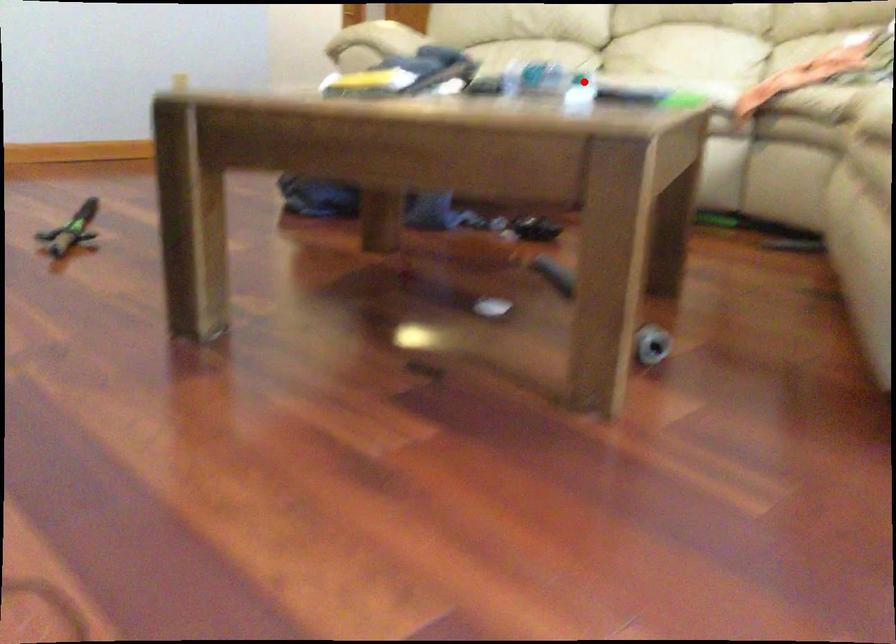
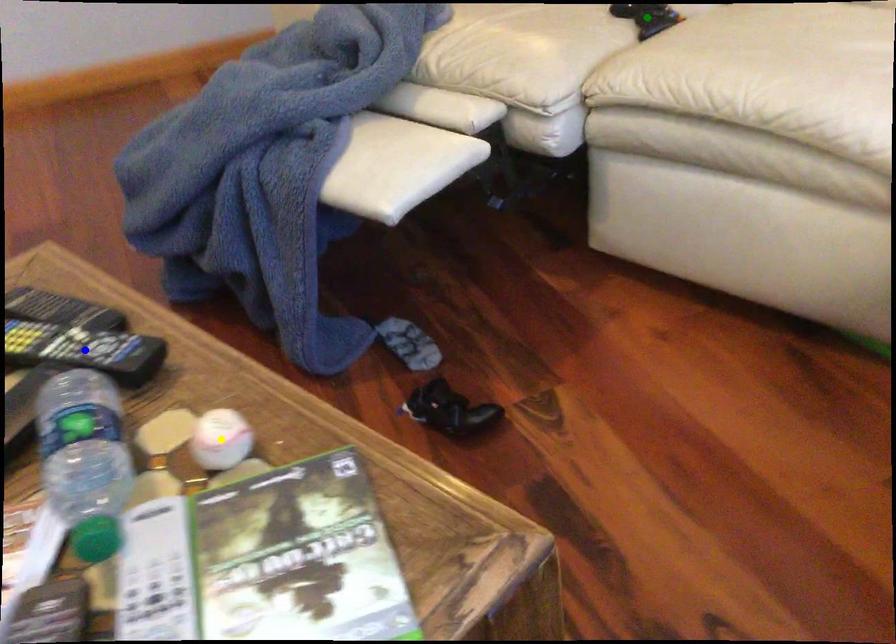
Question: I am providing you with two images of the same scene from different viewpoints. A red point is marked on the first image. You are given multiple points on the second image. Which point in image 2 is actually the same real-world point as the red point in image 1?

Choices:
 (A) blue point
 (B) yellow point
 (C) green point

Answer: (B)